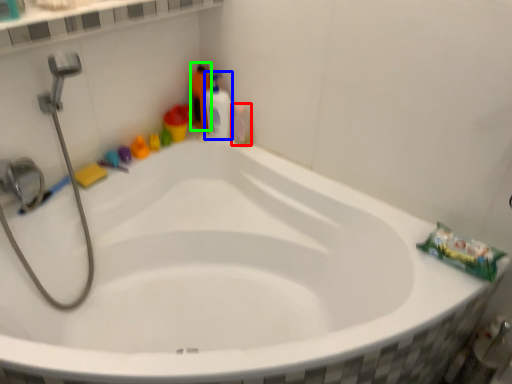
Question: Based on their relative distances, which object is farther from mouthwash (highlighted by a red box)? Choose from cleaning product (highlighted by a blue box) and cleaning product (highlighted by a green box).

Choices:
 (A) cleaning product
 (B) cleaning product

Answer: (B)